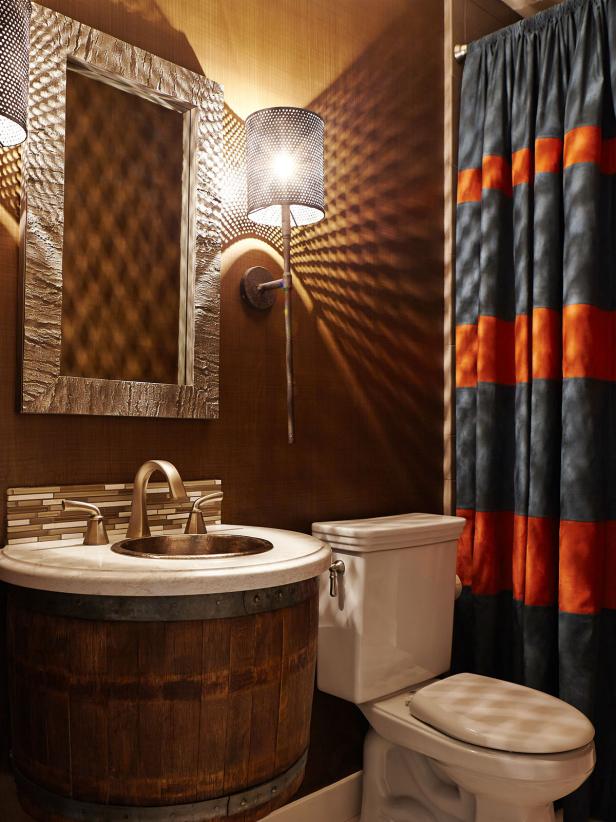
Locate an element on the screen. This screenshot has width=616, height=822. wall sconce is located at coordinates (278, 279).